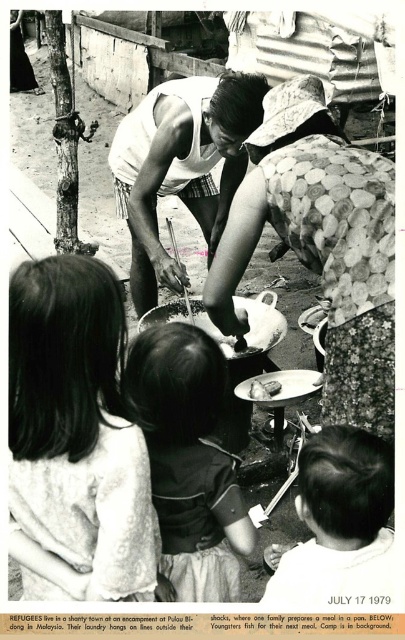
Question: Does matte white shirt at center appear on the right side of smooth white plate at center?

Choices:
 (A) no
 (B) yes

Answer: (A)

Question: Estimate the real-world distances between objects in this image. Which object is closer to the smooth fabric dress at center?

Choices:
 (A) dark hair at lower right
 (B) matte white shirt at center
 (C) smooth white plate at center

Answer: (A)

Question: Which of the following is the farthest from the observer?

Choices:
 (A) (266, 394)
 (B) (140, 131)

Answer: (B)

Question: Is smooth fabric dress at center below smooth white plate at center?

Choices:
 (A) yes
 (B) no

Answer: (A)

Question: Observing the image, what is the correct spatial positioning of floral fabric dress at center in reference to smooth white plate at center?

Choices:
 (A) right
 (B) left

Answer: (A)

Question: Which object is farther from the camera taking this photo?

Choices:
 (A) dark hair at center
 (B) smooth fabric dress at center
 (C) floral fabric dress at center
 (D) matte white shirt at center

Answer: (D)